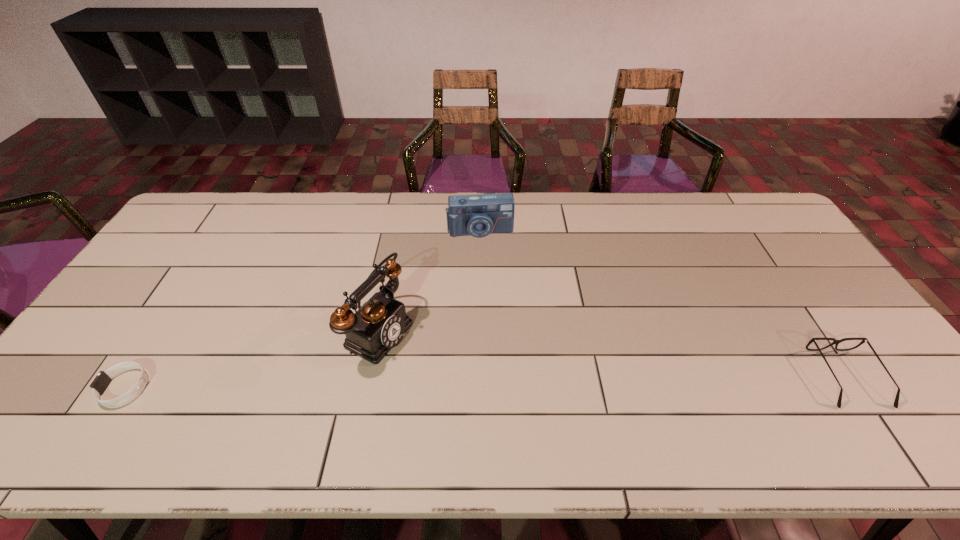
At what (x,y) coordinates should I click in order to perform the action: click on wristband. Please return your answer as a coordinate pair (x, y). This screenshot has width=960, height=540. Looking at the image, I should click on (103, 379).

Find the location of a particular element. The width and height of the screenshot is (960, 540). the shortest object is located at coordinates (103, 379).

At what (x,y) coordinates should I click in order to perform the action: click on spectacles. Please return your answer as a coordinate pair (x, y). This screenshot has height=540, width=960. Looking at the image, I should click on (836, 342).

This screenshot has width=960, height=540. Identify the location of the third tallest object. (836, 342).

In order to click on the second tallest object in this screenshot , I will do `click(479, 215)`.

The width and height of the screenshot is (960, 540). I want to click on camera, so click(x=479, y=215).

Locate an element on the screen. This screenshot has height=540, width=960. the second object from left to right is located at coordinates (379, 325).

What are the coordinates of `the tallest object` in the screenshot? It's located at (379, 325).

Image resolution: width=960 pixels, height=540 pixels. I want to click on vacant region located on the outer surface of the leftmost object, so click(x=75, y=388).

Image resolution: width=960 pixels, height=540 pixels. Find the location of `free space located on the outer surface of the leftmost object`. free space located on the outer surface of the leftmost object is located at coordinates (66, 388).